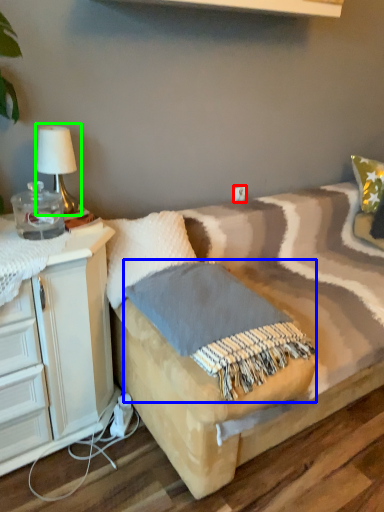
Question: Which object is positioned farthest from electric outlet (highlighted by a red box)? Select from blanket (highlighted by a blue box) and table lamp (highlighted by a green box).

Choices:
 (A) blanket
 (B) table lamp

Answer: (A)